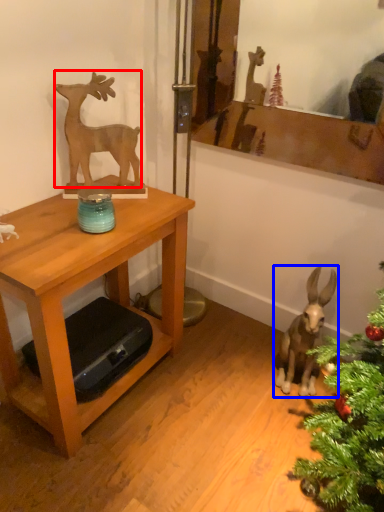
Question: Which point is further to the camera, deer (highlighted by a red box) or animal (highlighted by a blue box)?

Choices:
 (A) deer
 (B) animal

Answer: (B)